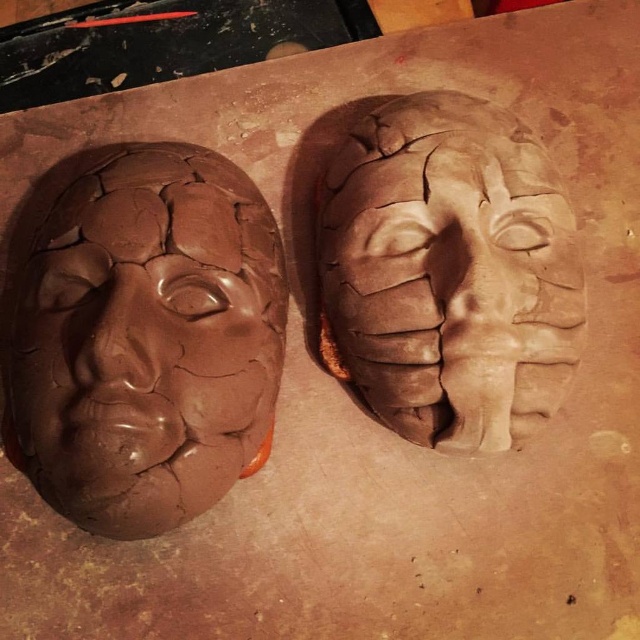
Which is below, matte clay mask at left or matte clay mask at center?

matte clay mask at left

In the scene shown: Does matte clay mask at left appear on the right side of matte clay mask at center?

No, matte clay mask at left is not to the right of matte clay mask at center.

Between point (109, 528) and point (515, 438), which one is positioned in front?

Point (109, 528)

At what (x,y) coordinates should I click in order to perform the action: click on matte clay mask at left. Please return your answer as a coordinate pair (x, y). This screenshot has width=640, height=640. Looking at the image, I should click on (141, 336).